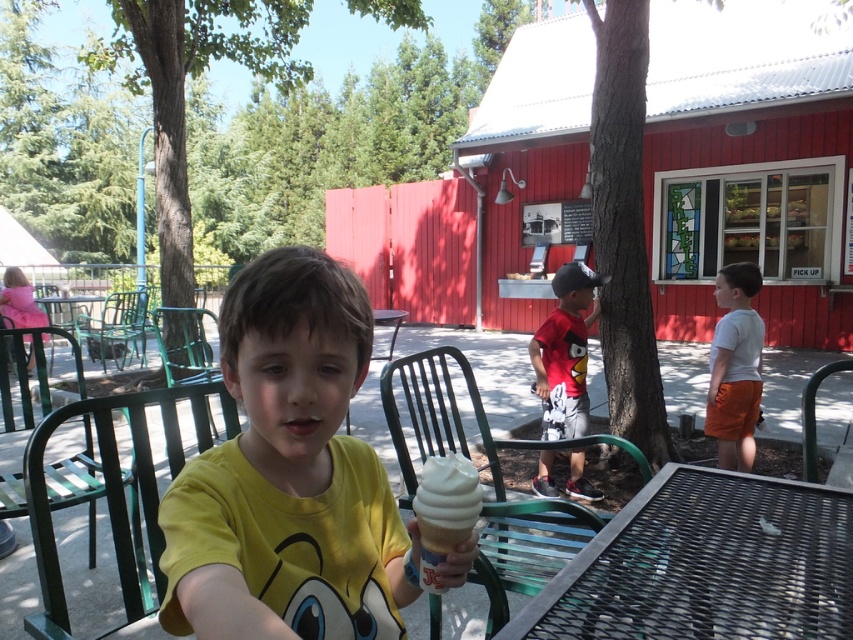
Question: In this image, where is yellow cotton shirt at center located relative to green metal chair at lower left?

Choices:
 (A) left
 (B) right

Answer: (B)

Question: Among these objects, which one is nearest to the camera?

Choices:
 (A) green metal table at left
 (B) green metal chair at lower left
 (C) yellow cotton shirt at center

Answer: (C)

Question: Does yellow cotton shirt at center have a lesser width compared to white cotton shirt at right?

Choices:
 (A) no
 (B) yes

Answer: (A)

Question: Considering the relative positions of green metal chair at lower center and red cotton shirt at center in the image provided, where is green metal chair at lower center located with respect to red cotton shirt at center?

Choices:
 (A) right
 (B) left

Answer: (B)

Question: Which object is farther from the camera taking this photo?

Choices:
 (A) yellow cotton shirt at center
 (B) white cotton shirt at right
 (C) green metal bench at left
 (D) green metal chair at left

Answer: (D)

Question: Among these objects, which one is farthest from the camera?

Choices:
 (A) green metal chair at lower center
 (B) black metal table at lower right
 (C) red cotton shirt at center
 (D) white cotton shirt at right

Answer: (D)